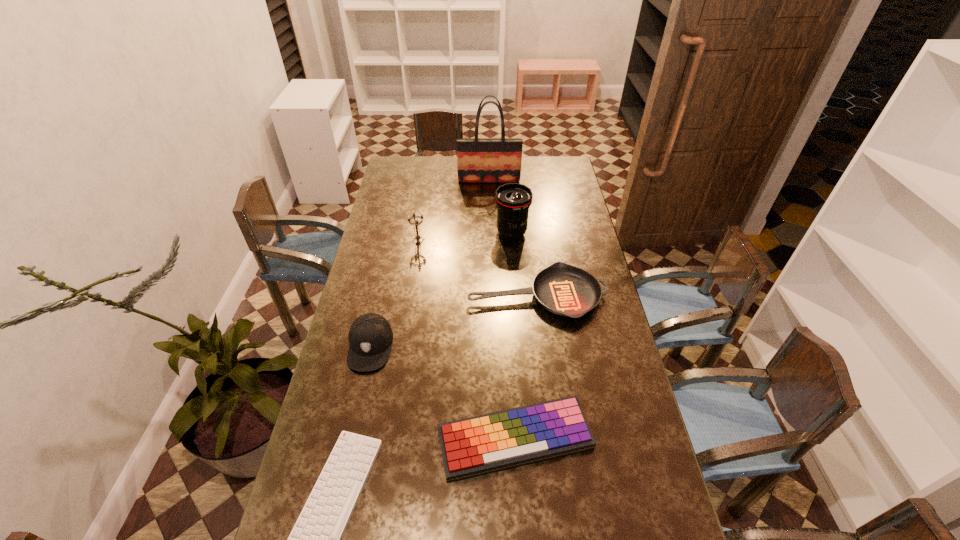
Where is `free space that satisfies the following two spatial constraints: 1. on the front-facing side of the cap; 2. on the left side of the taller computer keyboard`? The height and width of the screenshot is (540, 960). free space that satisfies the following two spatial constraints: 1. on the front-facing side of the cap; 2. on the left side of the taller computer keyboard is located at coordinates (349, 440).